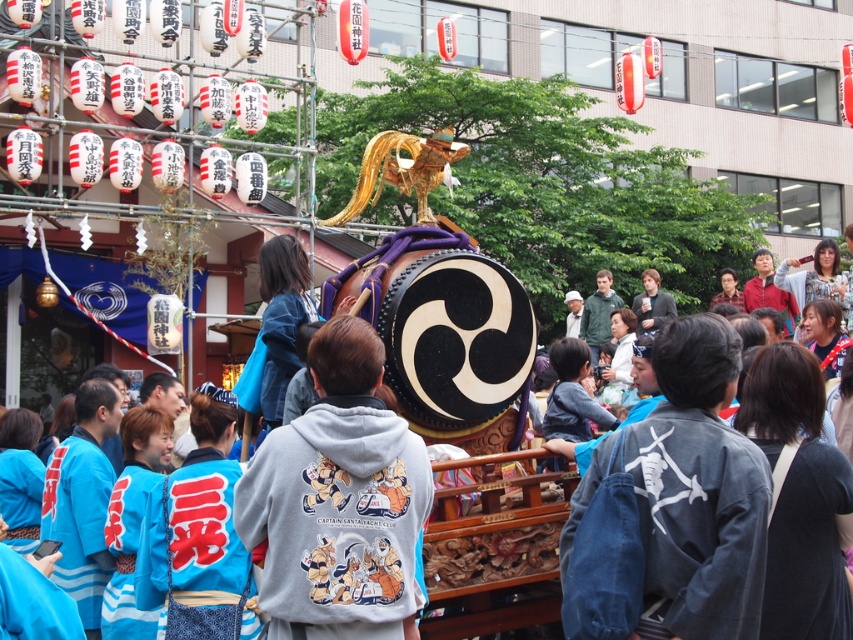
You are a photographer at the festival and want to capture both the denim jacket at lower right and the matte black jacket at center in a single shot. Which jacket should you focus on first to ensure both are in frame?

The denim jacket at lower right is taller than the matte black jacket at center, so focusing on the denim jacket at lower right first will help ensure both are in frame.

Consider the image. You are at the festival and want to place a gift at the exact location of the denim jacket at lower right. What coordinates should you aim for?

You should aim for the coordinates point (648, 364) where the denim jacket at lower right is located.

You are a photographer trying to capture a photo of the gray hoodie at center and the matte black jacket at center. If you want to ensure both are fully visible in the frame, which object should you focus on to avoid cropping?

You should focus on the matte black jacket at center because it occupies more space than the gray hoodie at center, ensuring both fit within the frame.